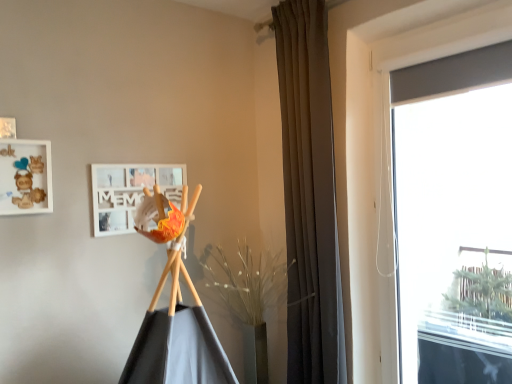
Question: Can you confirm if white matte picture frame at upper center, positioned as the first picture frame in back-to-front order, is positioned to the left of transparent glass window at right?

Choices:
 (A) yes
 (B) no

Answer: (A)

Question: Is white matte picture frame at upper center, the second picture frame from the left, positioned beyond the bounds of transparent glass window at right?

Choices:
 (A) no
 (B) yes

Answer: (B)

Question: Considering the relative positions of white matte picture frame at upper center, which ranks as the second picture frame in front-to-back order, and transparent glass window at right in the image provided, is white matte picture frame at upper center, which ranks as the second picture frame in front-to-back order, to the right of transparent glass window at right from the viewer's perspective?

Choices:
 (A) yes
 (B) no

Answer: (B)

Question: From a real-world perspective, is white matte picture frame at upper center, positioned as the first picture frame in back-to-front order, below transparent glass window at right?

Choices:
 (A) yes
 (B) no

Answer: (B)

Question: Considering the relative sizes of white matte picture frame at upper center, the first picture frame positioned from the right, and transparent glass window at right in the image provided, is white matte picture frame at upper center, the first picture frame positioned from the right, bigger than transparent glass window at right?

Choices:
 (A) yes
 (B) no

Answer: (B)

Question: Is white matte picture frame at upper center, the first picture frame positioned from the right, further to the viewer compared to transparent glass window at right?

Choices:
 (A) yes
 (B) no

Answer: (A)

Question: From the image's perspective, is wooden frame at upper left, the second picture frame viewed from the back, located above white matte picture frame at upper center, the second picture frame from the left?

Choices:
 (A) yes
 (B) no

Answer: (A)

Question: Does wooden frame at upper left, marked as the 2th picture frame in a right-to-left arrangement, have a lesser height compared to white matte picture frame at upper center, positioned as the first picture frame in back-to-front order?

Choices:
 (A) no
 (B) yes

Answer: (B)

Question: Is wooden frame at upper left, which is the 1th picture frame from left to right, outside of white matte picture frame at upper center, the first picture frame positioned from the right?

Choices:
 (A) yes
 (B) no

Answer: (A)

Question: From a real-world perspective, is wooden frame at upper left, marked as the 2th picture frame in a right-to-left arrangement, below white matte picture frame at upper center, which ranks as the second picture frame in front-to-back order?

Choices:
 (A) yes
 (B) no

Answer: (B)

Question: Would you say white matte picture frame at upper center, the first picture frame positioned from the right, is part of wooden frame at upper left, acting as the first picture frame starting from the front,'s contents?

Choices:
 (A) no
 (B) yes

Answer: (A)

Question: Is the position of wooden frame at upper left, which is the 1th picture frame from left to right, less distant than that of white matte picture frame at upper center, the second picture frame from the left?

Choices:
 (A) no
 (B) yes

Answer: (B)

Question: From a real-world perspective, is transparent glass window at right located beneath white matte picture frame at upper center, the second picture frame from the left?

Choices:
 (A) no
 (B) yes

Answer: (B)